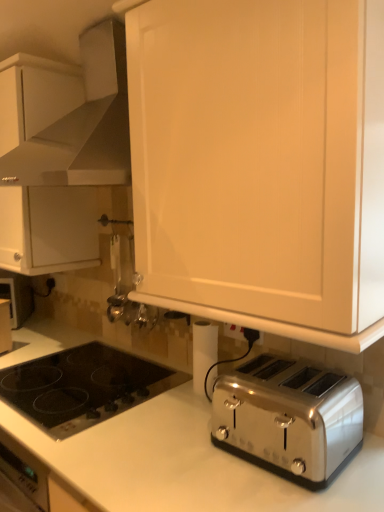
I want to click on free point above black glass cooktop at lower left (from a real-world perspective), so click(77, 357).